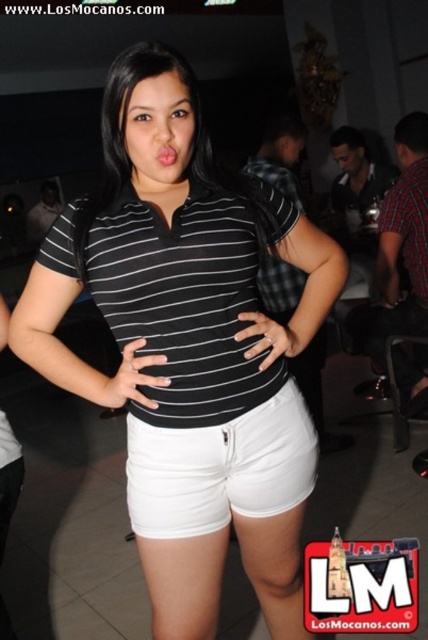
Question: Is black striped polo shirt at center closer to the viewer compared to white cotton shorts at center?

Choices:
 (A) no
 (B) yes

Answer: (B)

Question: Is black striped polo shirt at center to the right of white cotton shorts at center from the viewer's perspective?

Choices:
 (A) no
 (B) yes

Answer: (A)

Question: Which point is closer to the camera?

Choices:
 (A) black striped polo shirt at center
 (B) matte black polo shirt at center
 (C) white cotton shorts at center

Answer: (B)

Question: Which point is farther to the camera?

Choices:
 (A) black striped polo shirt at center
 (B) white cotton shorts at center
 (C) matte black polo shirt at center

Answer: (B)

Question: Among these points, which one is nearest to the camera?

Choices:
 (A) (142, 44)
 (B) (247, 257)
 (C) (305, 410)

Answer: (A)

Question: Is matte black polo shirt at center below white cotton shorts at center?

Choices:
 (A) yes
 (B) no

Answer: (B)